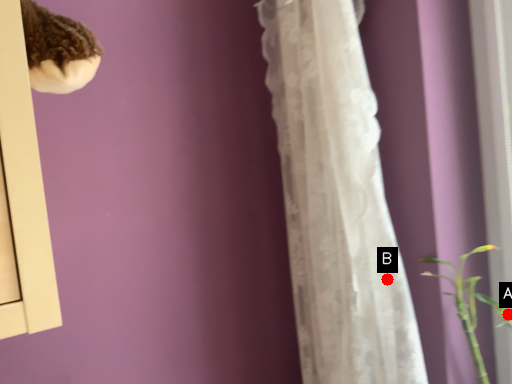
Question: Two points are circled on the image, labeled by A and B beside each circle. Among these points, which one is farthest from the camera?

Choices:
 (A) A is further
 (B) B is further

Answer: (B)